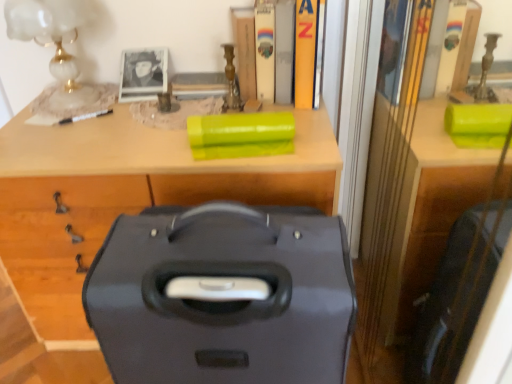
What are the coordinates of `vacant region in front of white marble table lamp at upper left` in the screenshot? It's located at (56, 133).